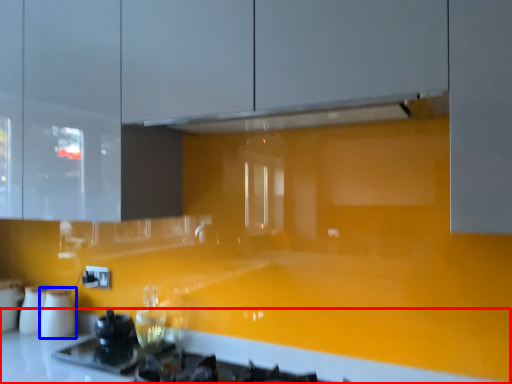
Question: Which point is further to the camera, counter top (highlighted by a red box) or appliance (highlighted by a blue box)?

Choices:
 (A) counter top
 (B) appliance

Answer: (B)